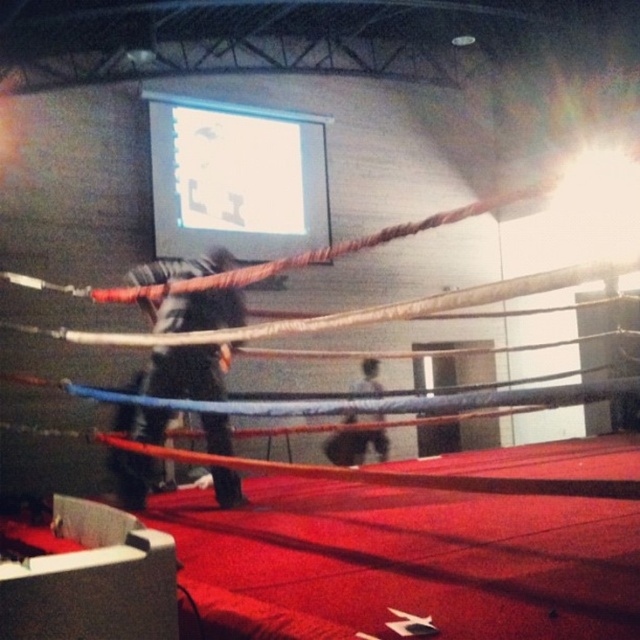
Is black matte pants at center below dark blue fabric at center?

No, black matte pants at center is not below dark blue fabric at center.

Who is taller, black matte pants at center or dark blue fabric at center?

Standing taller between the two is black matte pants at center.

In the scene shown: Who is more distant from viewer, (161, 420) or (344, 444)?

Positioned behind is point (344, 444).

The image size is (640, 640). I want to click on black matte pants at center, so click(182, 372).

Can you confirm if white glossy projection screen at upper center is thinner than dark blue fabric at center?

In fact, white glossy projection screen at upper center might be wider than dark blue fabric at center.

Between white glossy projection screen at upper center and dark blue fabric at center, which one is positioned higher?

white glossy projection screen at upper center

Is point (227, 205) positioned before point (358, 435)?

That is False.

Where is `white glossy projection screen at upper center`? The image size is (640, 640). white glossy projection screen at upper center is located at coordinates (236, 179).

Which is in front, point (296, 145) or point (131, 284)?

Point (131, 284) is more forward.

Where is `white glossy projection screen at upper center`? white glossy projection screen at upper center is located at coordinates (236, 179).